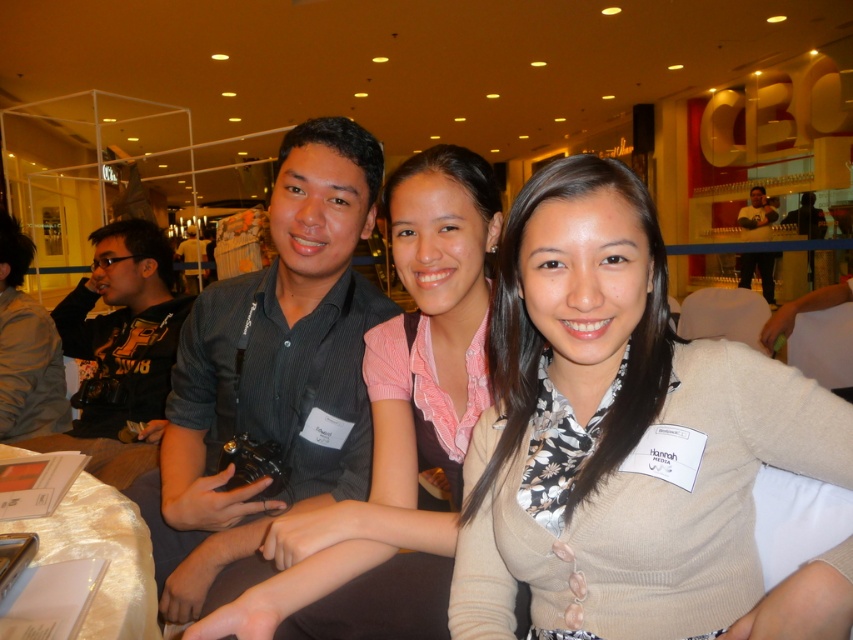
You are organizing a photography workshop and need to choose between two cameras for a demonstration. The black fabric camera at left and the matte black camera at upper right are available. Based on their sizes, which one would be more suitable for a hands on demonstration requiring easy handling?

The matte black camera at upper right is more suitable for the hands on demonstration because it has a smaller size compared to the black fabric camera at left, making it easier to handle during the workshop.